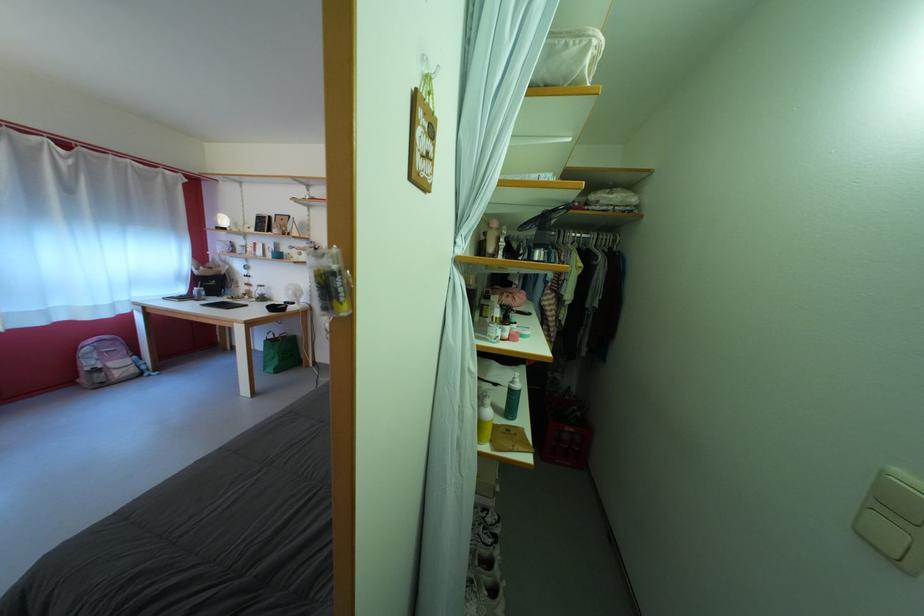
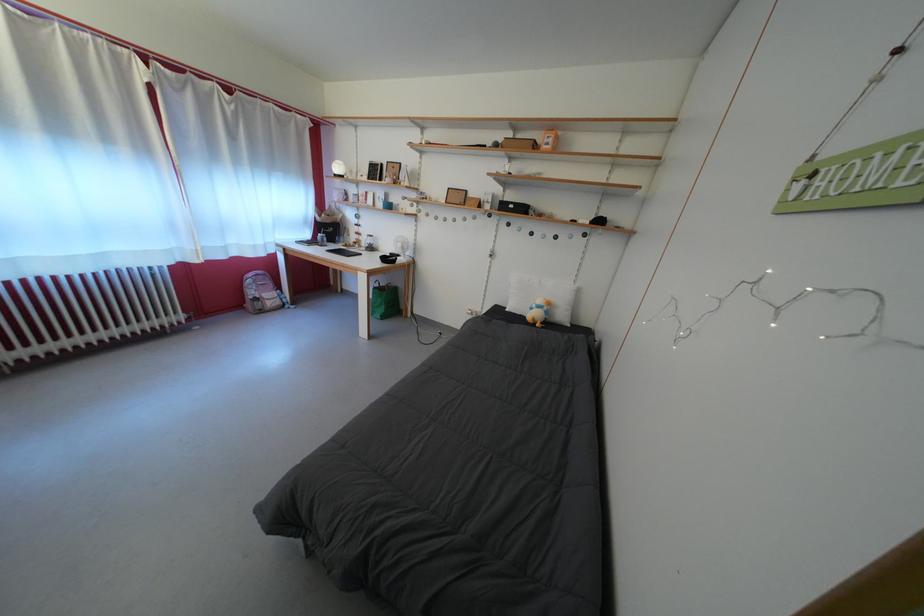
The point at (287, 306) is marked in the first image. Where is the corresponding point in the second image?

(394, 257)